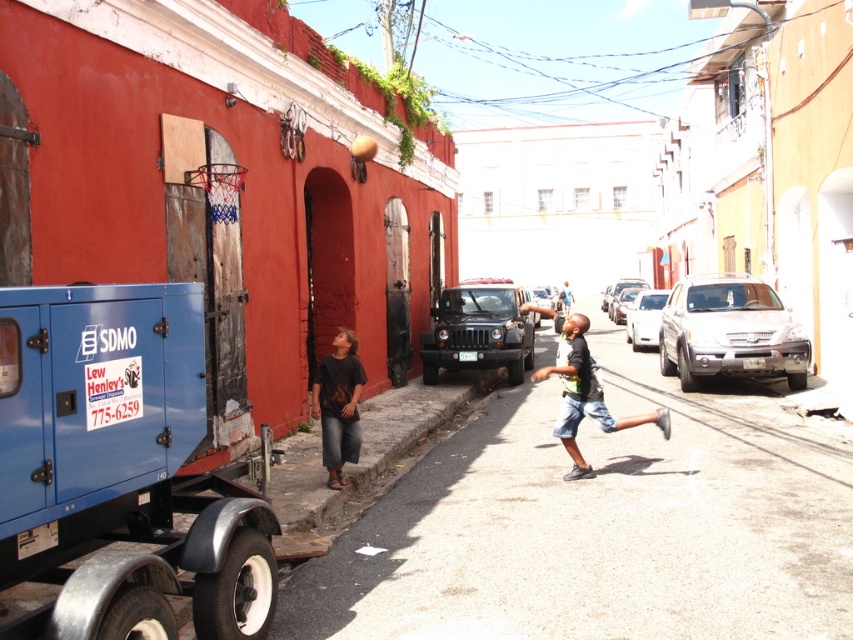
You are a delivery person needing to park your vehicle, which is 1.8 meters wide, in this scene. There is a matte black suv at center and dark blue denim shorts at center. Can you safely park your vehicle between them without touching either?

The matte black suv at center is narrower than the dark blue denim shorts at center. However, the distance between them isn

You are a pedestrian standing at the edge of the street. You see a matte black suv at center and dark blue denim shorts at center. Which object is closer to the left side of the street?

The matte black suv at center is closer to the left side of the street because it is positioned to the left of dark blue denim shorts at center.

You are a delivery person who needs to move a 1.5 meter wide box from the blue metallic generator at lower left to the dark blue denim shorts at center. Can you move the box without it hitting anything?

The blue metallic generator at lower left and dark blue denim shorts at center are 4.85 meters apart from each other. Since the box is only 1.5 meters wide, there is enough space to move it between them without hitting anything.